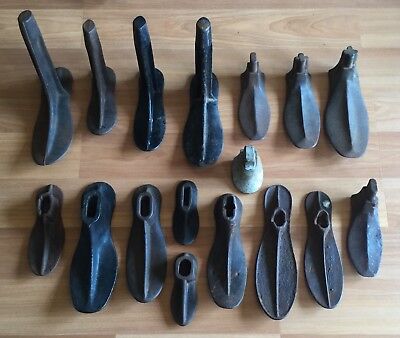
This screenshot has height=338, width=400. I want to click on light wood board of floor, so click(372, 318), click(18, 313), click(303, 21), click(390, 111), click(390, 64), click(51, 20), click(6, 155).